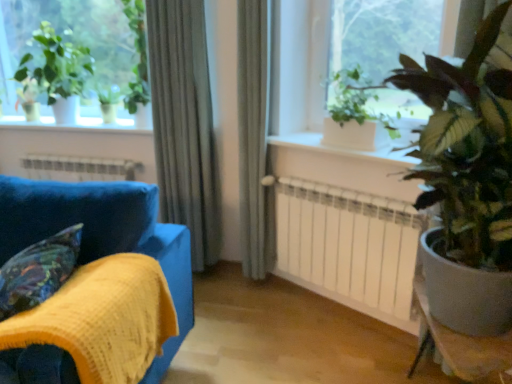
You are a GUI agent. You are given a task and a screenshot of the screen. Output one action in this format:
    pyautogui.click(x=<x>, y=<y>)
    Task: Click on the vacant space underneath white matte radiator at center (from a real-world perspective)
    This screenshot has height=384, width=512.
    Given the screenshot: What is the action you would take?
    pyautogui.click(x=332, y=314)